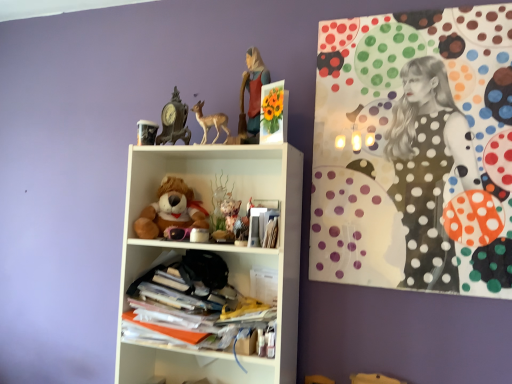
Image resolution: width=512 pixels, height=384 pixels. In order to click on free spot behind matte plastic figurine at upper center in this screenshot , I will do click(249, 154).